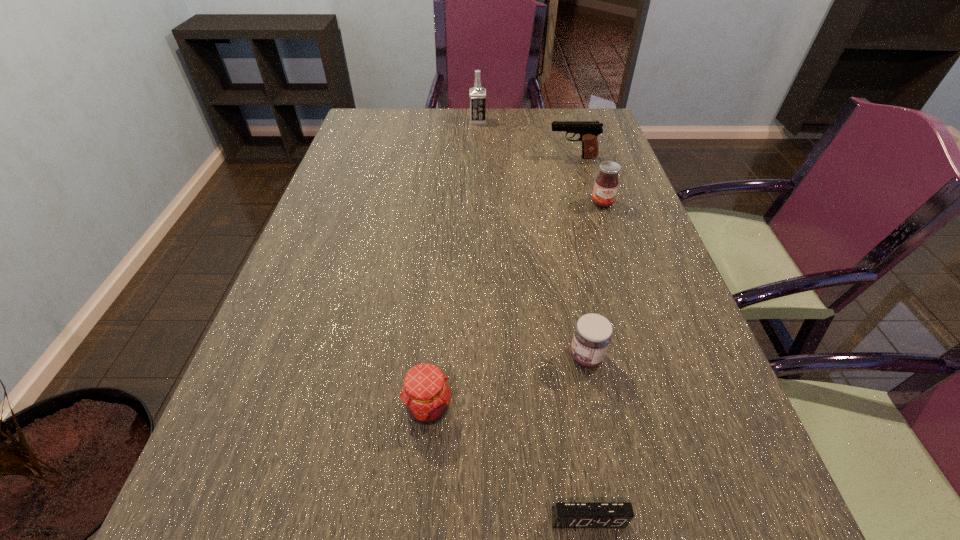
You are a GUI agent. You are given a task and a screenshot of the screen. Output one action in this format:
    pyautogui.click(x=<x>, y=<y>)
    Task: Click on the nearest object
    The height and width of the screenshot is (540, 960).
    Given the screenshot: What is the action you would take?
    pyautogui.click(x=564, y=515)

Locate an element on the screen. This screenshot has height=540, width=960. blank space located on the front label of the fifth object from right to left is located at coordinates (597, 122).

Where is `vacant region located 0.380m at the barrel of the second farthest object`? vacant region located 0.380m at the barrel of the second farthest object is located at coordinates (426, 158).

You are a GUI agent. You are given a task and a screenshot of the screen. Output one action in this format:
    pyautogui.click(x=<x>, y=<y>)
    Task: Click on the free point located 0.230m at the barrel of the second farthest object
    The width and height of the screenshot is (960, 540).
    Given the screenshot: What is the action you would take?
    pyautogui.click(x=474, y=158)

Identify the location of vacant space located 0.320m at the barrel of the second farthest object. This screenshot has height=540, width=960. (445, 158).

Where is `blank space located 0.380m on the label side of the tallest jam`? This screenshot has width=960, height=540. blank space located 0.380m on the label side of the tallest jam is located at coordinates (641, 320).

Locate an element on the screen. vacant area situated on the front label of the second jam from right to left is located at coordinates (501, 357).

This screenshot has width=960, height=540. In order to click on free region located 0.070m on the front label of the second jam from right to left in this screenshot , I will do tap(533, 357).

Locate an element on the screen. free location located on the front label of the second jam from right to left is located at coordinates (434, 357).

Locate an element on the screen. free space located 0.200m on the left of the leftmost jam is located at coordinates (289, 408).